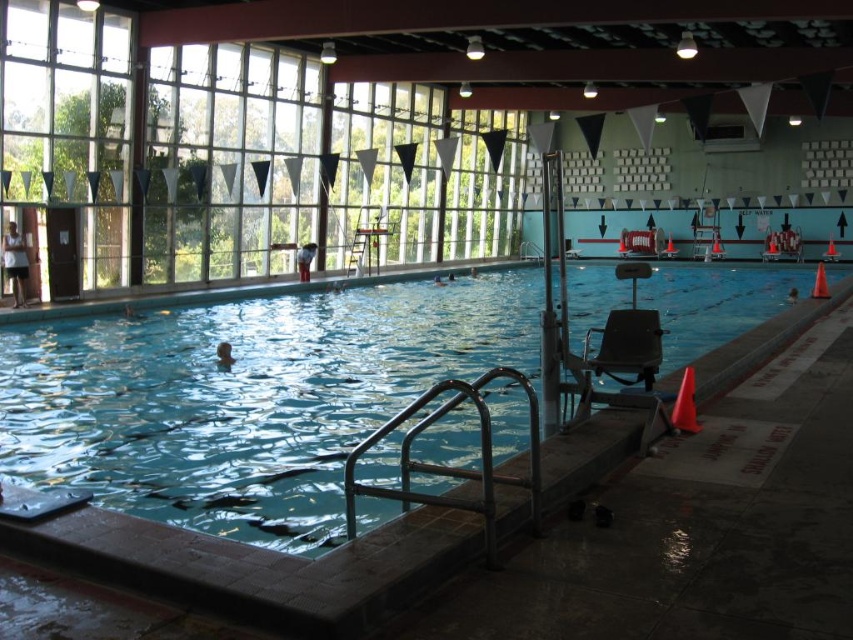
Question: Does white cotton shirt at left appear over matte black swimmer at center?

Choices:
 (A) yes
 (B) no

Answer: (B)

Question: Does matte black chair at center appear on the left side of smooth skin person at right?

Choices:
 (A) yes
 (B) no

Answer: (A)

Question: Estimate the real-world distances between objects in this image. Which object is farther from the white cotton shirt at left?

Choices:
 (A) brown skin at center
 (B) clear blue water at center
 (C) matte black chair at center

Answer: (C)

Question: Based on their relative distances, which object is farther from the white cotton shirt at left?

Choices:
 (A) clear blue water at center
 (B) smooth skin person at right

Answer: (B)

Question: Is brown skin at center wider than smooth skin person at center?

Choices:
 (A) yes
 (B) no

Answer: (A)

Question: Which point is farther to the camera?

Choices:
 (A) brown skin at center
 (B) white cotton shirt at left

Answer: (B)